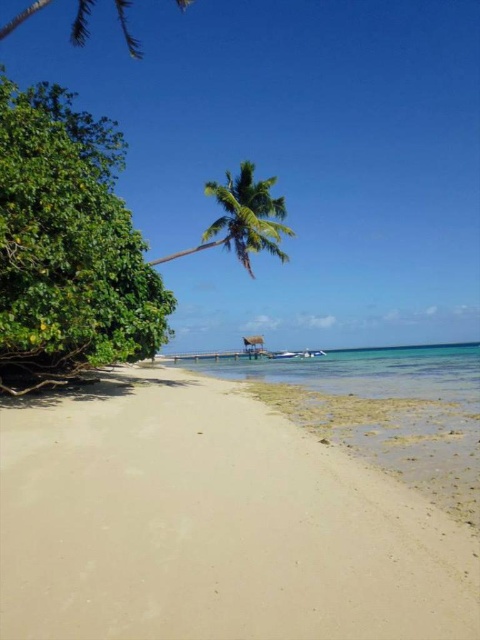
You are a photographer planning to capture the beige sandy beach at lower left and the green leafy palm tree at upper left in a single shot. Based on their sizes in the image, which object would appear more dominant in the photo?

The green leafy palm tree at upper left would appear more dominant in the photo because it is larger than the beige sandy beach at lower left.

You are standing at the center of the image and want to walk to the beige sandy beach at lower left. Which direction should you face to head directly towards it?

The beige sandy beach at lower left is located at point (213, 524), which is to the lower left direction from your current position at the center. Therefore, you should face towards the lower left direction to head directly towards it.